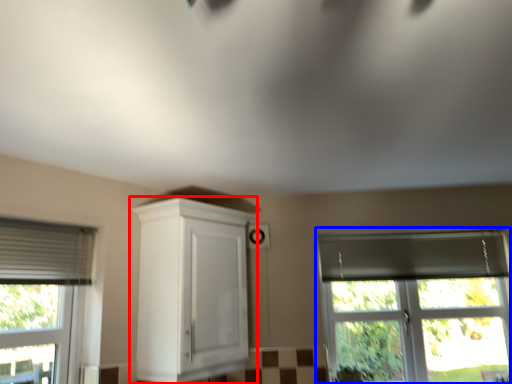
Question: Among these objects, which one is nearest to the camera, cabinetry (highlighted by a red box) or window (highlighted by a blue box)?

Choices:
 (A) cabinetry
 (B) window

Answer: (A)